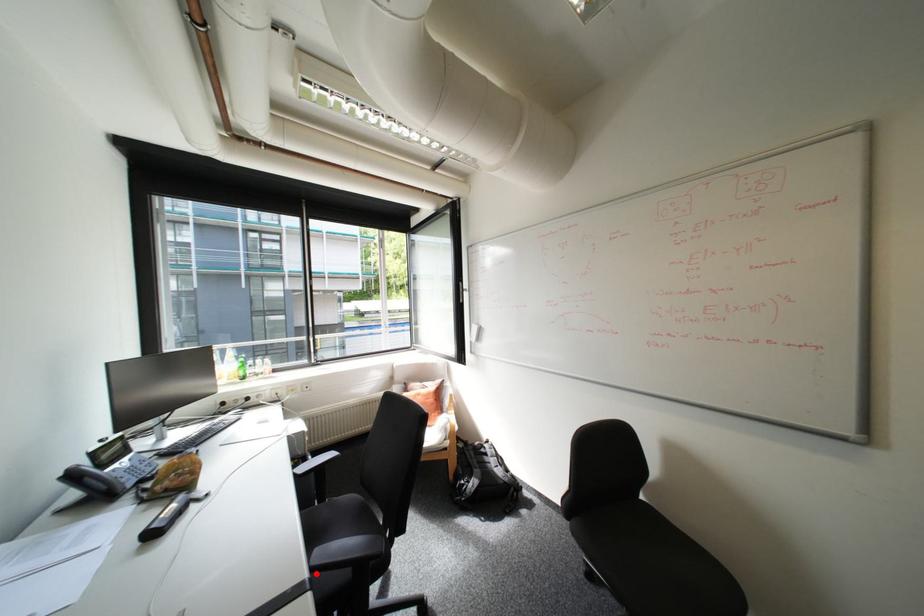
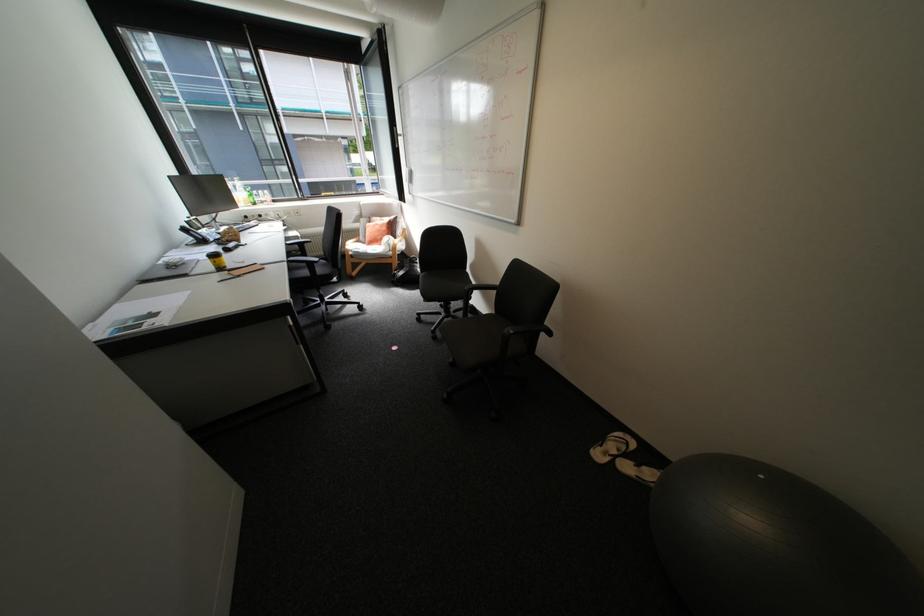
Find the pixel in the second image that matches the highlighted location in the first image.

(295, 259)